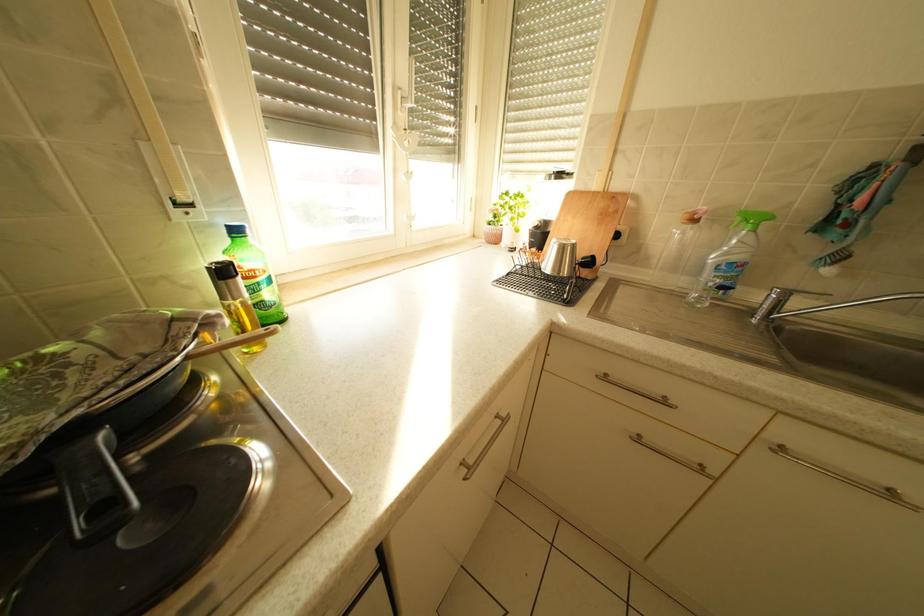
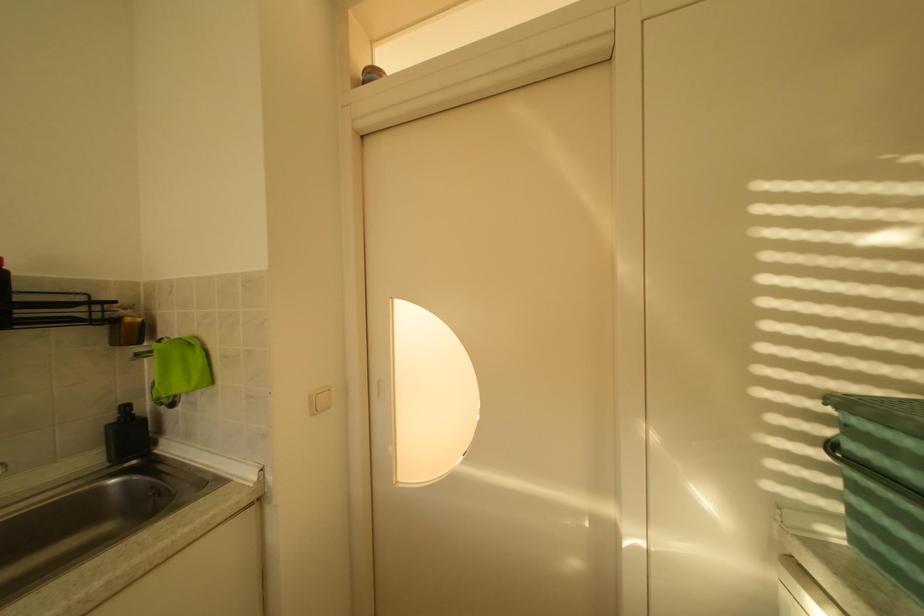
Question: The camera is either moving clockwise (left) or counter-clockwise (right) around the object. The first image is from the beginning of the video and the second image is from the end. Is the camera moving left or right when shooting the video?

Choices:
 (A) Left
 (B) Right

Answer: (A)